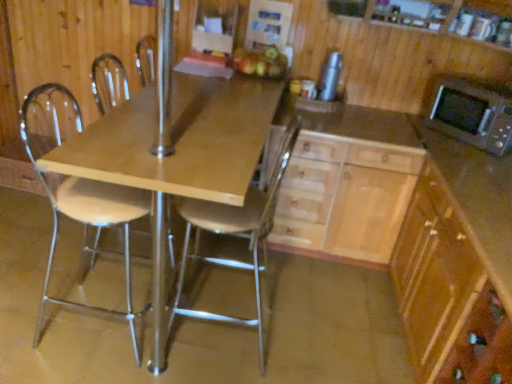
You are a GUI agent. You are given a task and a screenshot of the screen. Output one action in this format:
    pyautogui.click(x=<x>, y=<y>)
    Task: Click on the free space below white plastic chair at left, the second chair viewed from the right (from a real-world perspective)
    This screenshot has height=384, width=512.
    Given the screenshot: What is the action you would take?
    pyautogui.click(x=89, y=317)